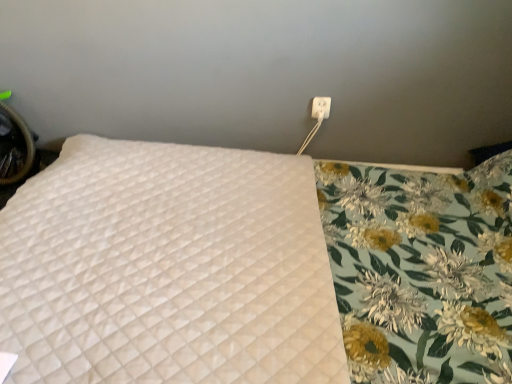
Image resolution: width=512 pixels, height=384 pixels. What do you see at coordinates (254, 269) in the screenshot? I see `white quilted mattress at upper left` at bounding box center [254, 269].

What is the approximate width of white quilted mattress at upper left?

white quilted mattress at upper left is 6.96 feet in width.

What is the approximate height of white quilted mattress at upper left?

white quilted mattress at upper left is 26.15 inches tall.

I want to click on white quilted mattress at upper left, so click(254, 269).

The height and width of the screenshot is (384, 512). Find the location of `white plastic outlet at upper right`. white plastic outlet at upper right is located at coordinates (321, 107).

Describe the element at coordinates (321, 107) in the screenshot. The image size is (512, 384). I see `white plastic outlet at upper right` at that location.

At what (x,y) coordinates should I click in order to perform the action: click on white quilted mattress at upper left. Please return your answer as a coordinate pair (x, y). Looking at the image, I should click on (254, 269).

From the picture: Which is more to the right, white quilted mattress at upper left or white plastic outlet at upper right?

Positioned to the right is white plastic outlet at upper right.

In the image, is white quilted mattress at upper left positioned in front of or behind white plastic outlet at upper right?

white quilted mattress at upper left is in front of white plastic outlet at upper right.

Is point (190, 368) more distant than point (328, 116)?

No.

Based on the photo, from the image's perspective, relative to white plastic outlet at upper right, is white quilted mattress at upper left above or below?

Based on their image positions, white quilted mattress at upper left is located beneath white plastic outlet at upper right.

From a real-world perspective, is white quilted mattress at upper left beneath white plastic outlet at upper right?

Yes.

Between white quilted mattress at upper left and white plastic outlet at upper right, which one has larger width?

white quilted mattress at upper left is wider.

Does white quilted mattress at upper left have a lesser height compared to white plastic outlet at upper right?

No.

Considering the sizes of objects white quilted mattress at upper left and white plastic outlet at upper right in the image provided, who is smaller, white quilted mattress at upper left or white plastic outlet at upper right?

white plastic outlet at upper right.

Would you say white plastic outlet at upper right is part of white quilted mattress at upper left's contents?

No, white plastic outlet at upper right is not surrounded by white quilted mattress at upper left.

Can you see white quilted mattress at upper left touching white plastic outlet at upper right?

white quilted mattress at upper left and white plastic outlet at upper right are not in contact.

Is white quilted mattress at upper left positioned with its back to white plastic outlet at upper right?

That's not correct — white quilted mattress at upper left is not looking away from white plastic outlet at upper right.

Measure the distance between white quilted mattress at upper left and white plastic outlet at upper right.

white quilted mattress at upper left and white plastic outlet at upper right are 82.02 centimeters apart.

Where is `electric outlet to the right of white quilted mattress at upper left`? The height and width of the screenshot is (384, 512). electric outlet to the right of white quilted mattress at upper left is located at coordinates (321, 107).

Would you say white plastic outlet at upper right is to the left or to the right of white quilted mattress at upper left in the picture?

white plastic outlet at upper right is positioned on white quilted mattress at upper left's right side.

Is white plastic outlet at upper right positioned in front of white quilted mattress at upper left?

No, the depth of white plastic outlet at upper right is greater than that of white quilted mattress at upper left.

Which is nearer, (316, 110) or (507, 215)?

Point (316, 110) is positioned farther from the camera compared to point (507, 215).

From the image's perspective, is white plastic outlet at upper right above or below white quilted mattress at upper left?

From the image's perspective, white plastic outlet at upper right appears above white quilted mattress at upper left.

From a real-world perspective, relative to white quilted mattress at upper left, is white plastic outlet at upper right vertically above or below?

white plastic outlet at upper right is above white quilted mattress at upper left.

In the scene shown: Which of these two, white plastic outlet at upper right or white quilted mattress at upper left, is thinner?

white plastic outlet at upper right is thinner.

Does white plastic outlet at upper right have a lesser height compared to white quilted mattress at upper left?

Yes, white plastic outlet at upper right is shorter than white quilted mattress at upper left.

Considering the sizes of white plastic outlet at upper right and white quilted mattress at upper left in the image, is white plastic outlet at upper right bigger or smaller than white quilted mattress at upper left?

In the image, white plastic outlet at upper right appears to be smaller than white quilted mattress at upper left.

Based on the photo, would you say white plastic outlet at upper right is inside or outside white quilted mattress at upper left?

white plastic outlet at upper right is spatially situated outside white quilted mattress at upper left.

Would you say white plastic outlet at upper right is a long distance from white quilted mattress at upper left?

No, there isn't a large distance between white plastic outlet at upper right and white quilted mattress at upper left.

Is white plastic outlet at upper right oriented away from white quilted mattress at upper left?

white plastic outlet at upper right does not have its back to white quilted mattress at upper left.

Identify the location of electric outlet above the white quilted mattress at upper left (from the image's perspective). (321, 107).

Identify the location of bed below the white plastic outlet at upper right (from a real-world perspective). (254, 269).

The image size is (512, 384). In the image, there is a white quilted mattress at upper left. Find the location of `electric outlet above it (from the image's perspective)`. electric outlet above it (from the image's perspective) is located at coordinates (321, 107).